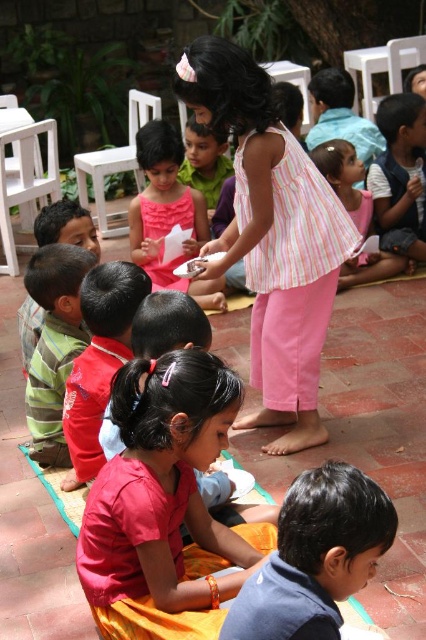
Question: Where is matte pink dress at center located in relation to pink satin dress at center in the image?

Choices:
 (A) above
 (B) below

Answer: (B)

Question: Which object is positioned farthest from the blue cotton shirt at lower right?

Choices:
 (A) white plastic chair at left
 (B) pink striped shirt at center

Answer: (A)

Question: Can you confirm if blue cotton shirt at lower right is positioned above matte green shirt at left?

Choices:
 (A) no
 (B) yes

Answer: (A)

Question: Considering the real-world distances, which object is farthest from the pink satin dress at center?

Choices:
 (A) white plastic chair at left
 (B) pink cotton dress at center
 (C) matte pink dress at center

Answer: (C)

Question: Can you confirm if white plastic chair at left is thinner than white plastic chair at center?

Choices:
 (A) yes
 (B) no

Answer: (A)

Question: Which object is closer to the camera taking this photo?

Choices:
 (A) white plastic chair at left
 (B) pink fabric dress at center
 (C) light blue denim shorts at lower right
 (D) matte green shirt at left

Answer: (D)